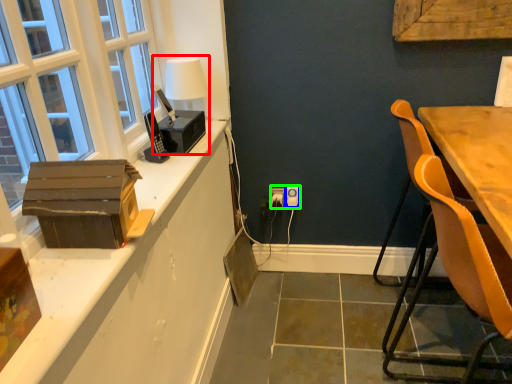
Question: Considering the real-world distances, which object is farthest from table lamp (highlighted by a red box)? power outlet (highlighted by a blue box) or electric outlet (highlighted by a green box)?

Choices:
 (A) power outlet
 (B) electric outlet

Answer: (A)